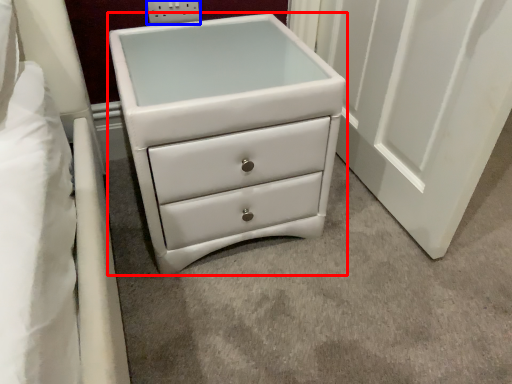
Question: Among these objects, which one is farthest to the camera, chest of drawers (highlighted by a red box) or electric outlet (highlighted by a blue box)?

Choices:
 (A) chest of drawers
 (B) electric outlet

Answer: (B)